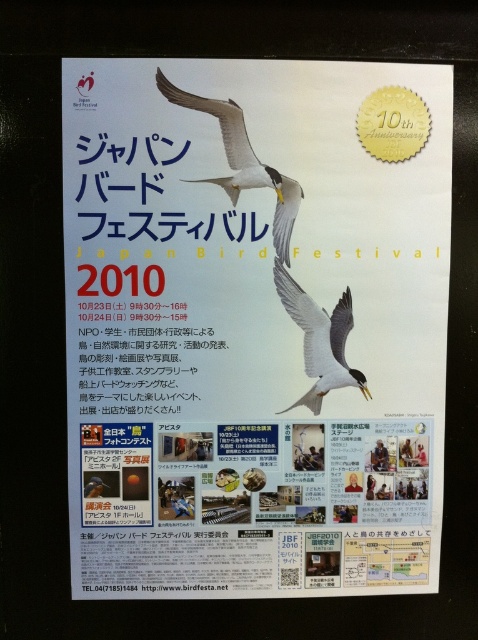
You are a festival organizer checking the layout of the promotional materials. You need to ensure that the white paper poster at upper center is placed above the white glossy bird at center for better visibility. Is this currently the case?

The white paper poster at upper center is positioned under the white glossy bird at center, so it is not placed above it. Adjust the layout to move the white paper poster at upper center above the white glossy bird at center for better visibility.

You are an event planner reviewing the Japan Bird Festival 2010 poster. You notice the white paper poster at upper center and the white glossy seagull at upper center. Which object is taller?

The white paper poster at upper center is taller than the white glossy seagull at upper center.

You are an art student analyzing the promotional poster for the Japan Bird Festival 2010. You notice the white paper poster at upper center and the white glossy bird at center. Which object is taller?

The white paper poster at upper center is taller than the white glossy bird at center.